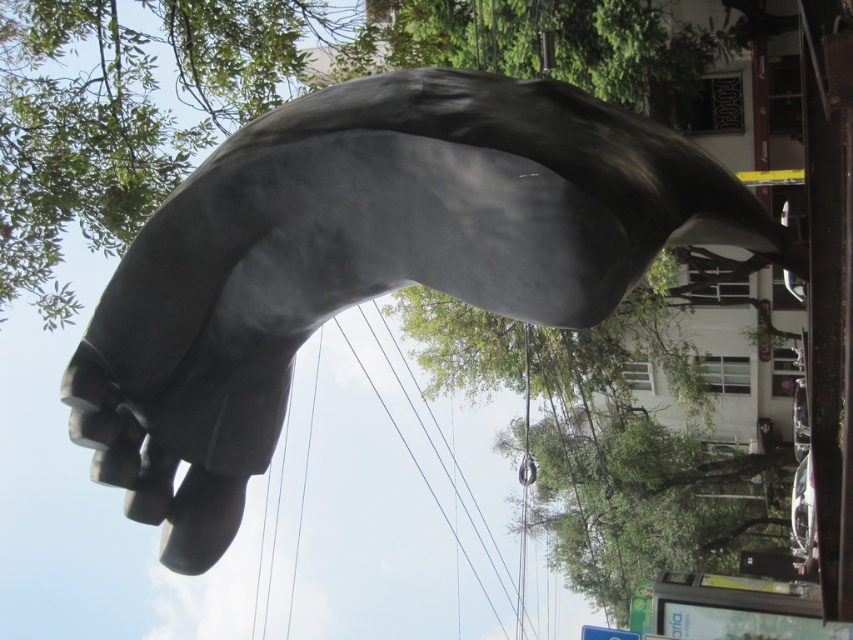
Question: Among these points, which one is farthest from the camera?

Choices:
 (A) (657, 556)
 (B) (171, 344)

Answer: (A)

Question: Does satin gray hand at center have a smaller size compared to green leafy tree at center?

Choices:
 (A) yes
 (B) no

Answer: (B)

Question: Which of the following is the farthest from the observer?

Choices:
 (A) (537, 515)
 (B) (271, 346)

Answer: (A)

Question: Does satin gray hand at center have a smaller size compared to green leafy tree at center?

Choices:
 (A) no
 (B) yes

Answer: (A)

Question: Considering the relative positions of satin gray hand at center and green leafy tree at center in the image provided, where is satin gray hand at center located with respect to green leafy tree at center?

Choices:
 (A) above
 (B) below

Answer: (A)